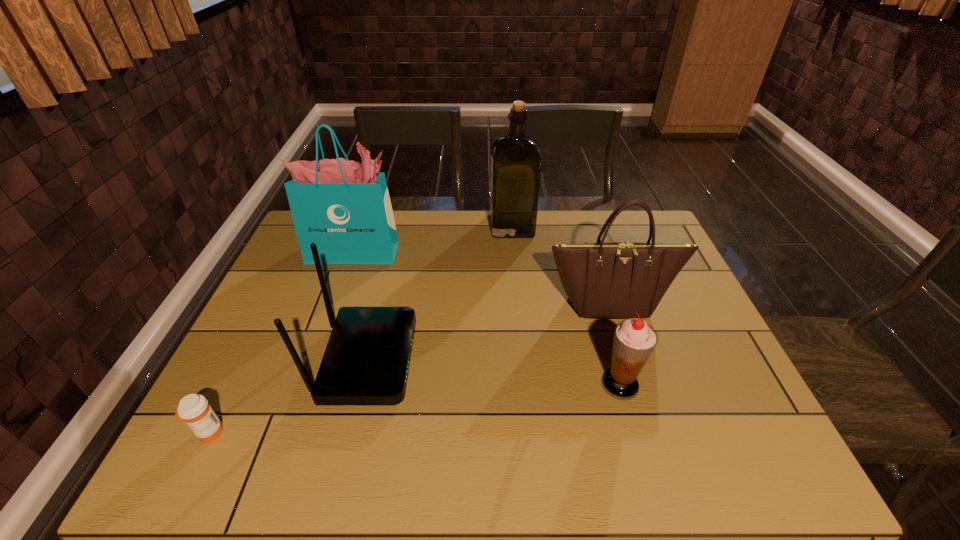
This screenshot has height=540, width=960. Find the location of `object at the right edge`. object at the right edge is located at coordinates (612, 280).

The image size is (960, 540). In order to click on object at the far left corner in this screenshot , I will do `click(344, 207)`.

You are a GUI agent. You are given a task and a screenshot of the screen. Output one action in this format:
    pyautogui.click(x=<x>, y=<y>)
    Task: Click on the object at the near left corner
    This screenshot has height=540, width=960.
    Given the screenshot: What is the action you would take?
    194,409

The image size is (960, 540). What are the coordinates of `free location at the far edge of the desktop` in the screenshot? It's located at (454, 212).

Find the location of a particular element. This screenshot has height=540, width=960. vacant space at the near edge of the desktop is located at coordinates (566, 444).

Find the location of `vacant region at the left edge of the desktop`. vacant region at the left edge of the desktop is located at coordinates (297, 296).

At what (x,y) coordinates should I click in order to perform the action: click on vacant space at the right edge of the desktop. Please return your answer as a coordinate pair (x, y). The height and width of the screenshot is (540, 960). Looking at the image, I should click on (695, 427).

In the image, there is a desktop. Identify the location of free space at the near left corner. The width and height of the screenshot is (960, 540). (235, 477).

Identify the location of vacant space that is in between the fourth tallest object and the shopping bag. The height and width of the screenshot is (540, 960). (361, 306).

Locate an element on the screen. free space between the shopping bag and the liquor is located at coordinates (434, 239).